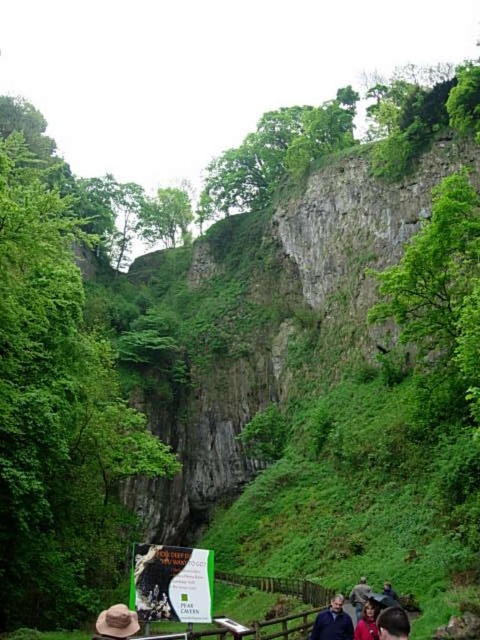
You are a photographer planning to capture a wide shot of the canyon. You notice the white paper sign at center and the dark blue jacket at lower center in your frame. Based on their sizes in the image, which object would appear larger in your photo?

The white paper sign at center appears larger in the photo because its width is greater than that of the dark blue jacket at lower center.

You are a hiker standing on the wooden pathway in the canyon. You want to read the information on the white paper sign at center. Where should you look relative to your current position?

You should look towards the center of the scene where the white paper sign at center is located.

You are a hiker standing on the wooden walkway in the canyon. You see the white paper sign at center and the red fabric jacket at lower right. Which object is closer to you?

The white paper sign at center is closer to you because it is further to the viewer than the red fabric jacket at lower right.